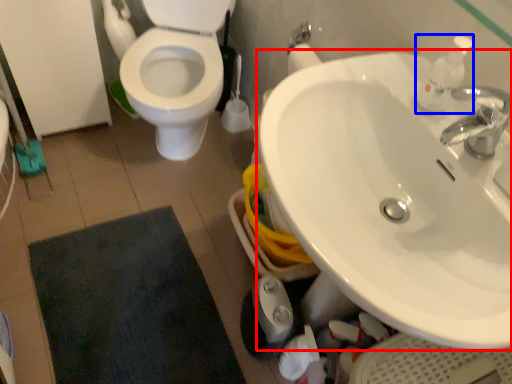
Question: Which object appears farthest to the camera in this image, sink (highlighted by a red box) or soap dispenser (highlighted by a blue box)?

Choices:
 (A) sink
 (B) soap dispenser

Answer: (B)